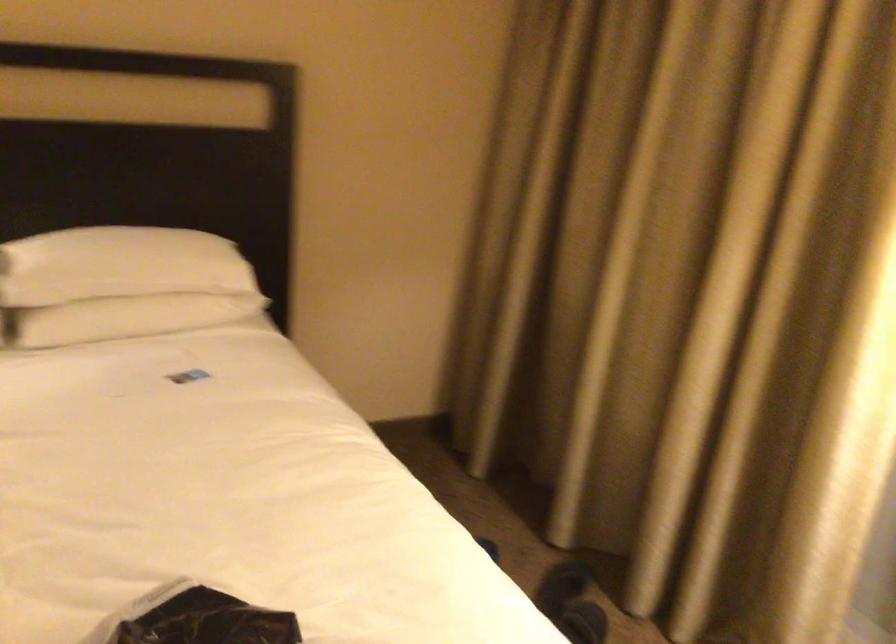
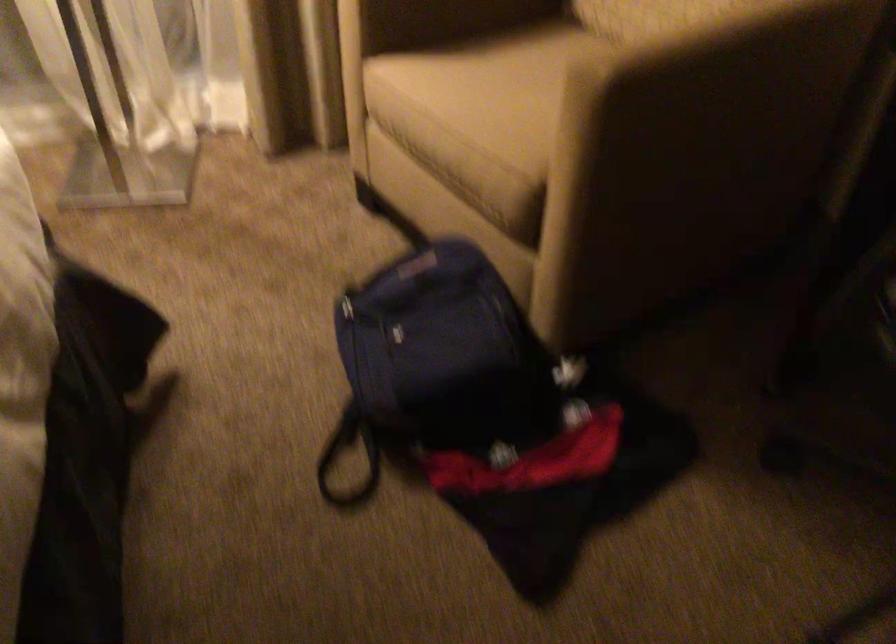
The images are taken continuously from a first-person perspective. In which direction is your viewpoint rotating?

The camera's rotation is toward right-down.